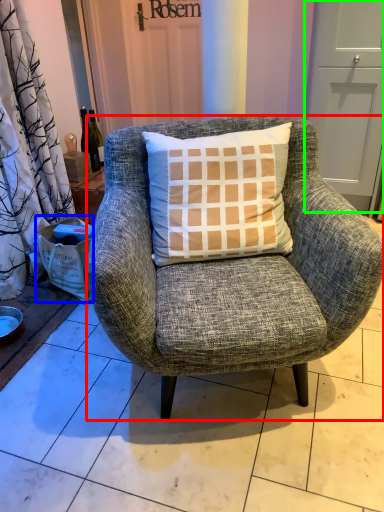
Question: Which is nearer to the chair (highlighted by a red box)? box (highlighted by a blue box) or screen door (highlighted by a green box).

Choices:
 (A) box
 (B) screen door

Answer: (A)